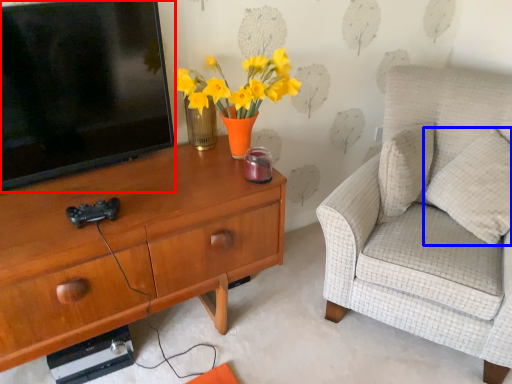
Question: Which object is closer to the camera taking this photo, television (highlighted by a red box) or pillow (highlighted by a blue box)?

Choices:
 (A) television
 (B) pillow

Answer: (A)